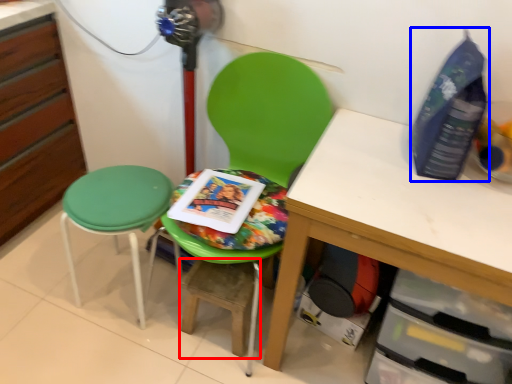
Question: Which of the following is the closest to the observer, step stool (highlighted by a red box) or bottle (highlighted by a blue box)?

Choices:
 (A) step stool
 (B) bottle

Answer: (B)